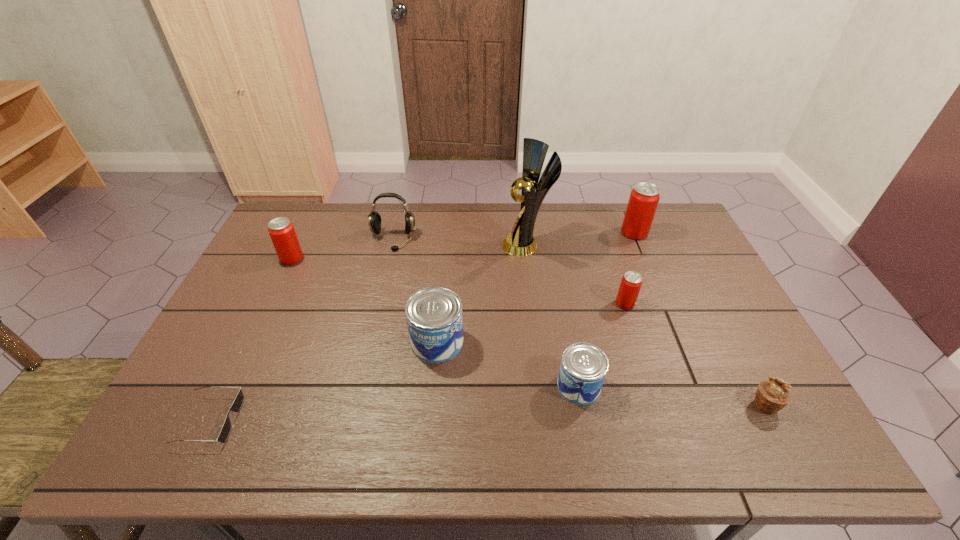
Identify the location of free space located 0.180m on the right of the leftmost can. This screenshot has height=540, width=960. (358, 259).

Locate an element on the screen. free location located 0.350m on the front label of the fourth farthest can is located at coordinates (591, 342).

This screenshot has width=960, height=540. In order to click on free space located 0.380m on the back of the fifth nearest object in this screenshot , I will do 598,222.

Find the location of a particular element. The image size is (960, 540). vacant space situated on the front label of the nearer blue can is located at coordinates (397, 386).

Locate an element on the screen. This screenshot has width=960, height=540. vacant space situated 0.100m on the front label of the nearer blue can is located at coordinates point(517,386).

Locate an element on the screen. This screenshot has height=540, width=960. vacant position located on the front label of the nearer blue can is located at coordinates (481, 386).

You are a GUI agent. You are given a task and a screenshot of the screen. Output one action in this format:
    pyautogui.click(x=<x>, y=<y>)
    Task: Click on the free space located on the back of the rightmost object
    
    Given the screenshot: What is the action you would take?
    pyautogui.click(x=706, y=292)

Locate an element on the screen. free location located 0.090m on the front-facing side of the shortest object is located at coordinates (274, 420).

I want to click on award positioned at the far edge, so click(x=520, y=243).

Where is `can at the far edge`? can at the far edge is located at coordinates (644, 198).